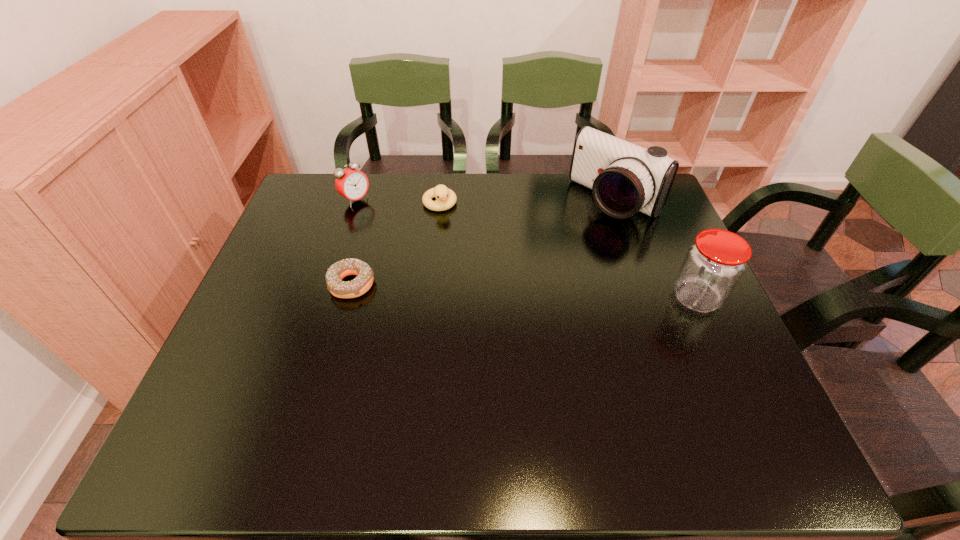
Locate which object is the second closest to the alarm clock. Please provide its 2D coordinates. Your answer should be formatted as a tuple, i.e. [(x, y)], where the tuple contains the x and y coordinates of a point satisfying the conditions above.

[(362, 283)]

Select which object is the third closest to the shortest object. Please provide its 2D coordinates. Your answer should be formatted as a tuple, i.e. [(x, y)], where the tuple contains the x and y coordinates of a point satisfying the conditions above.

[(625, 178)]

This screenshot has height=540, width=960. Identify the location of vacant space that satisfies the following two spatial constraints: 1. on the front side of the jar; 2. on the left side of the camcorder. pyautogui.click(x=649, y=298).